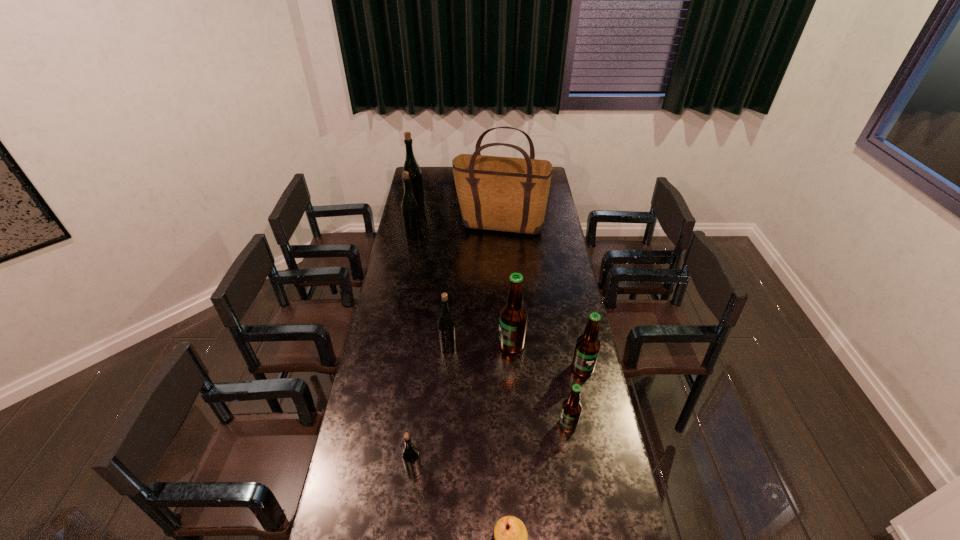
Where is `tote bag`? This screenshot has width=960, height=540. tote bag is located at coordinates (507, 194).

The width and height of the screenshot is (960, 540). Find the location of `the biggest green beer bottle`. the biggest green beer bottle is located at coordinates (416, 182).

You are a GUI agent. You are given a task and a screenshot of the screen. Output one action in this format:
    pyautogui.click(x=<x>, y=<y>)
    Task: Click on the farthest beer bottle
    The image size is (960, 540).
    Given the screenshot: What is the action you would take?
    pyautogui.click(x=416, y=182)

I want to click on the second farthest beer bottle, so [409, 207].

This screenshot has width=960, height=540. I want to click on the third nearest green beer bottle, so click(x=409, y=207).

This screenshot has width=960, height=540. I want to click on the farthest brown beer bottle, so click(x=513, y=316).

Locate an element on the screen. The height and width of the screenshot is (540, 960). the biggest brown beer bottle is located at coordinates (513, 316).

You are a GUI agent. You are given a task and a screenshot of the screen. Output one action in this format:
    pyautogui.click(x=<x>, y=<y>)
    Task: Click on the fourth beer bottle from left to right
    This screenshot has width=960, height=540.
    Given the screenshot: What is the action you would take?
    pyautogui.click(x=446, y=326)

Find the location of `the third farthest green beer bottle`. the third farthest green beer bottle is located at coordinates (446, 326).

Find the location of a particular element. the second biggest brown beer bottle is located at coordinates (588, 345).